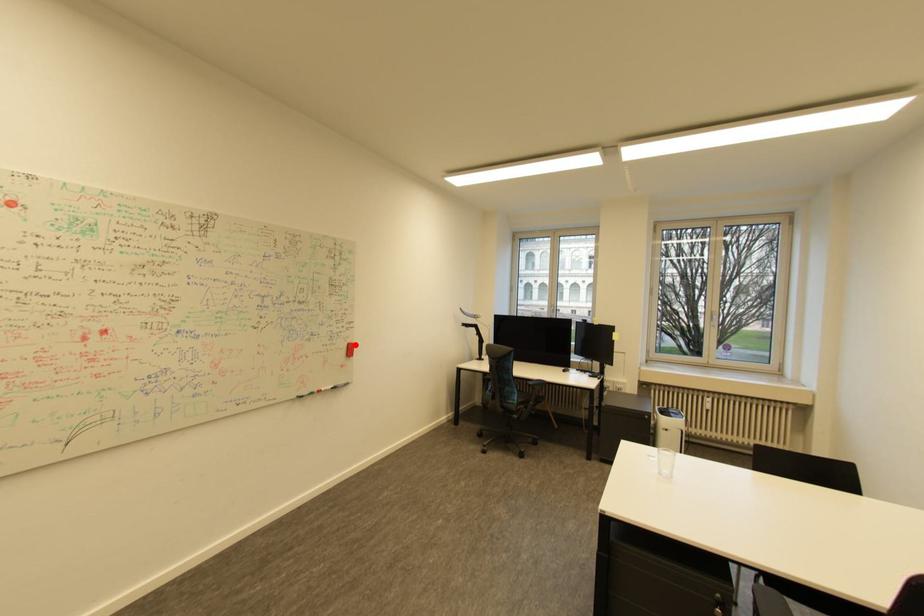
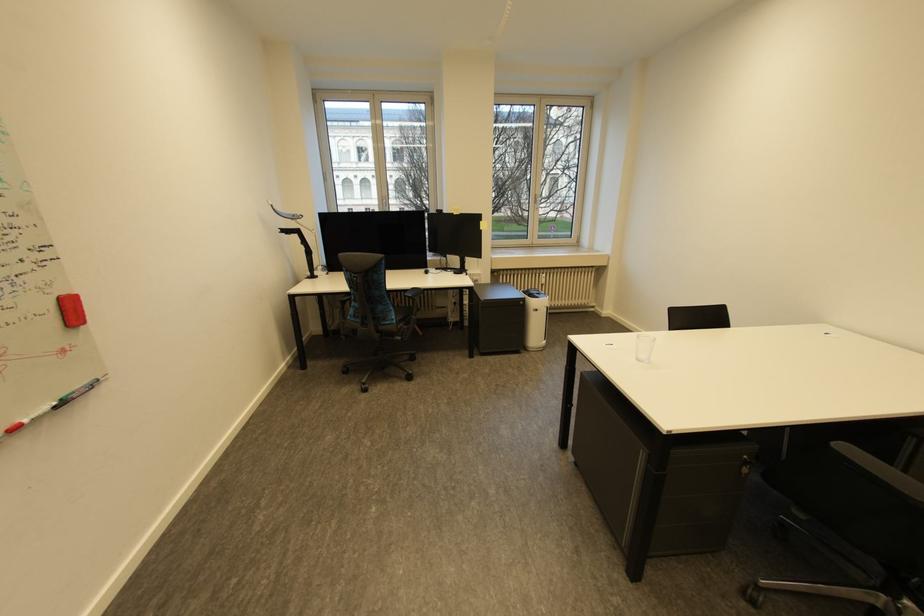
Locate, in the second image, the point that corresponds to the highlighted location in the first image.

(67, 300)